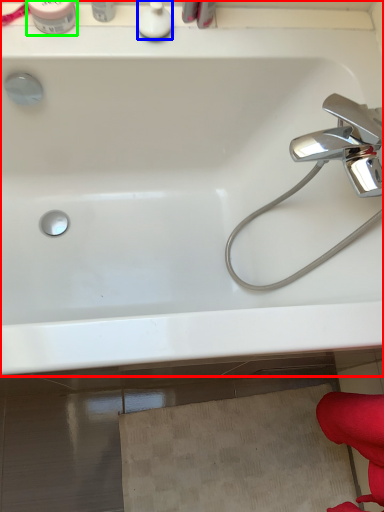
Question: Which object is the closest to the bathtub (highlighted by a red box)? Choose among these: toiletry (highlighted by a blue box) or toiletry (highlighted by a green box).

Choices:
 (A) toiletry
 (B) toiletry

Answer: (A)